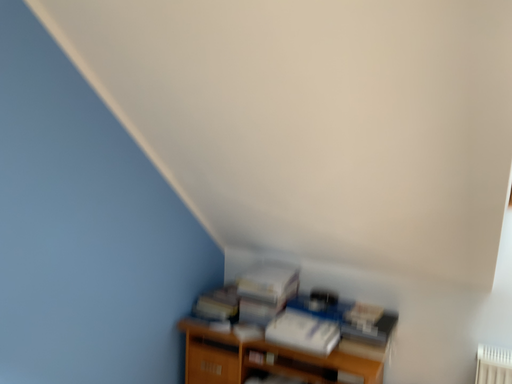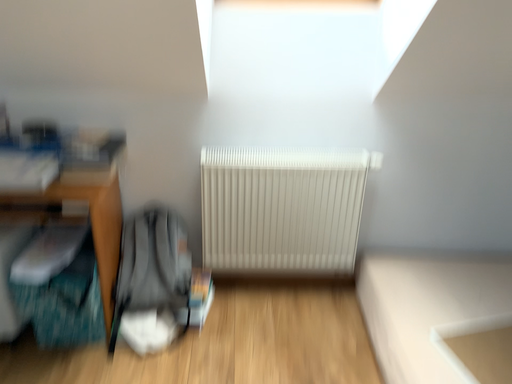
Question: Which way did the camera rotate in the video?

Choices:
 (A) rotated downward
 (B) rotated upward

Answer: (A)